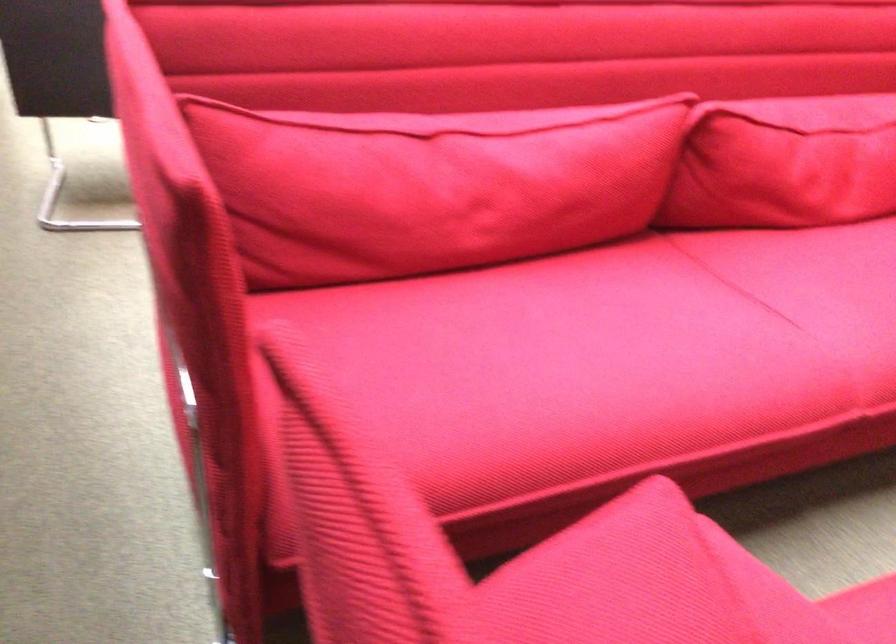
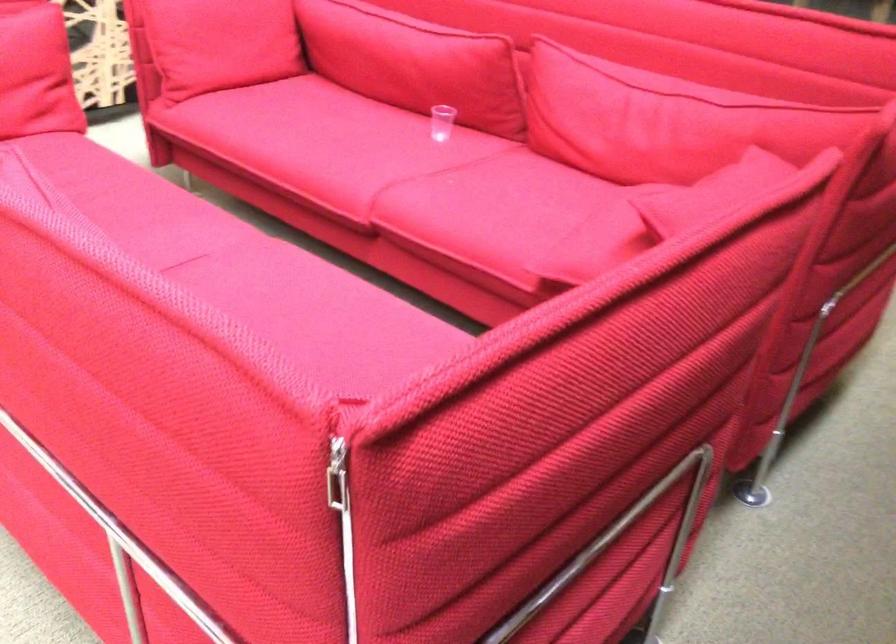
Where in the second image is the point corresponding to pixel 727 321 from the first image?

(244, 270)